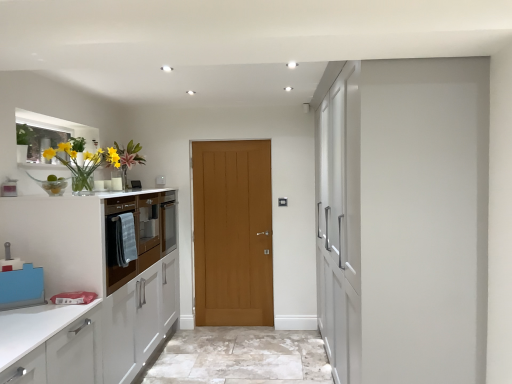
Where is `vacant area that is situated to the right of wooden door at center`? The image size is (512, 384). vacant area that is situated to the right of wooden door at center is located at coordinates (276, 336).